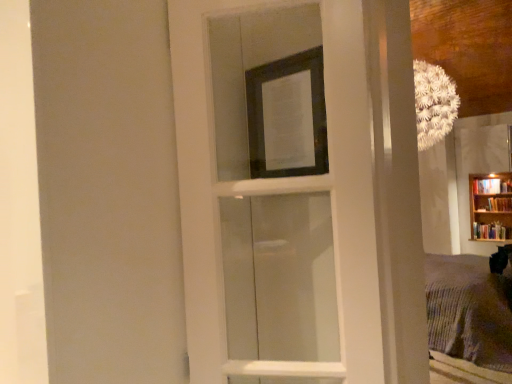
Question: In terms of height, does transparent glass screen door at upper center look taller or shorter compared to wooden bookcase at right?

Choices:
 (A) tall
 (B) short

Answer: (A)

Question: In terms of size, does transparent glass screen door at upper center appear bigger or smaller than wooden bookcase at right?

Choices:
 (A) small
 (B) big

Answer: (B)

Question: Considering the real-world distances, which object is closest to the wooden bookcase at right?

Choices:
 (A) white glass door at center
 (B) matte black picture frame at upper center
 (C) transparent glass screen door at upper center

Answer: (A)

Question: Estimate the real-world distances between objects in this image. Which object is closer to the white glass door at center?

Choices:
 (A) wooden bookcase at right
 (B) transparent glass screen door at upper center
 (C) matte black picture frame at upper center

Answer: (C)